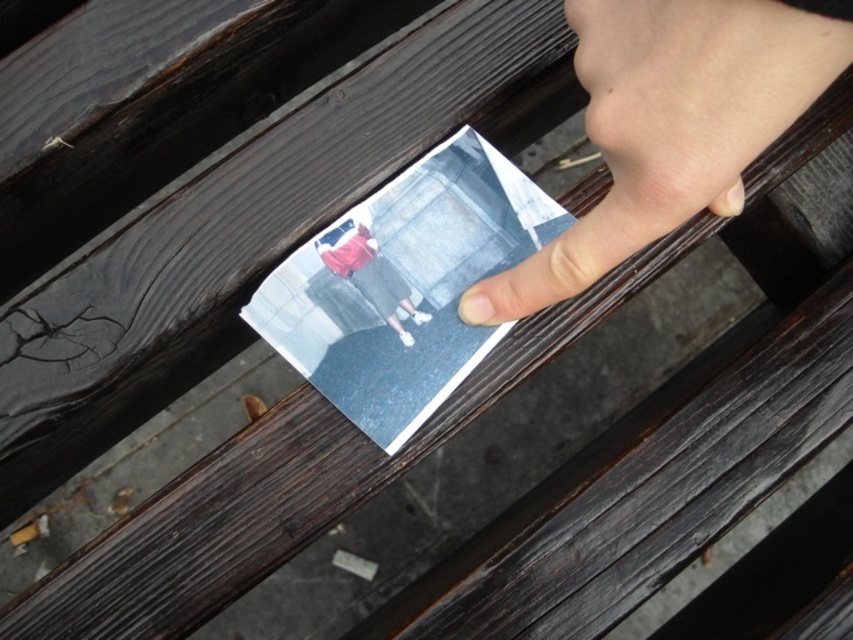
You are looking at a photograph held by a hand. In the photo, there are two people. One has pale skin at upper right and the other wears a matte red shirt at center. Based on their positions in the photo, which person is standing to the right of the other?

The pale skin at upper right is positioned on the right side of matte red shirt at center, so the person with pale skin at upper right is standing to the right of the person in the matte red shirt at center.

You are an artist trying to sketch the scene. You notice the pale skin at upper right and the matte paper postcard at center. Which object should you draw first if you want to start with the larger one?

The pale skin at upper right should be drawn first because it has a larger size compared to the matte paper postcard at center.

You are holding a matte red shirt at center and a matte paper postcard at center. Which one is closer to your hand?

The matte paper postcard at center is positioned under the matte red shirt at center, so the matte red shirt at center is closer to your hand.